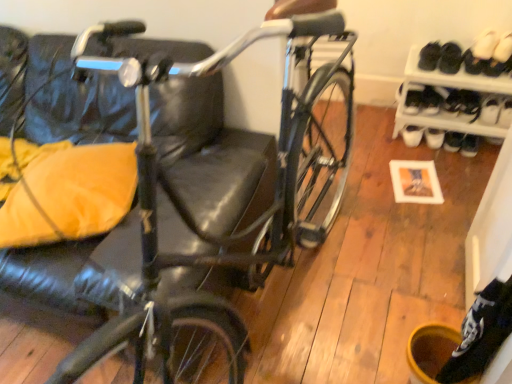
Find the location of `white suede shoe at upper right, the third footwear when ordered from left to right`. white suede shoe at upper right, the third footwear when ordered from left to right is located at coordinates (499, 56).

What is the approximate height of black suede shoes at upper right, which appears as the 1th footwear when viewed from the left?

black suede shoes at upper right, which appears as the 1th footwear when viewed from the left, is 4.62 inches tall.

Describe the element at coordinates (490, 110) in the screenshot. Image resolution: width=512 pixels, height=384 pixels. I see `white leather shoe at right` at that location.

What is the approximate height of shiny black bicycle at center?

shiny black bicycle at center is 1.20 meters in height.

Image resolution: width=512 pixels, height=384 pixels. Find the location of `orange fabric pillow at left`. orange fabric pillow at left is located at coordinates (71, 194).

I want to click on white plastic shoe rack at lower right, so click(x=450, y=100).

The height and width of the screenshot is (384, 512). I want to click on white suede shoe at upper right, the third footwear when ordered from left to right, so coord(499,56).

Can you tell me how much white leather shoe at right and white suede shoe at upper right, arranged as the 2th footwear when viewed from the right, differ in facing direction?

The angular difference between white leather shoe at right and white suede shoe at upper right, arranged as the 2th footwear when viewed from the right, is 4.27 degrees.

Is white leather shoe at right located outside white suede shoe at upper right, the 2th footwear from the left?

Absolutely, white leather shoe at right is external to white suede shoe at upper right, the 2th footwear from the left.

Can you confirm if white leather shoe at right is thinner than white suede shoe at upper right, arranged as the 2th footwear when viewed from the right?

Incorrect, the width of white leather shoe at right is not less than that of white suede shoe at upper right, arranged as the 2th footwear when viewed from the right.

From a real-world perspective, is white leather shoe at right above or below white suede shoe at upper right, arranged as the 2th footwear when viewed from the right?

From a real-world perspective, white leather shoe at right is physically below white suede shoe at upper right, arranged as the 2th footwear when viewed from the right.

From a real-world perspective, between black suede shoes at upper right, which appears as the 1th footwear when viewed from the left, and orange fabric pillow at left, who is vertically higher?

In real-world perspective, orange fabric pillow at left is above.

How far apart are black suede shoes at upper right, which appears as the 1th footwear when viewed from the left, and orange fabric pillow at left?

black suede shoes at upper right, which appears as the 1th footwear when viewed from the left, and orange fabric pillow at left are 5.75 feet apart.

Based on the photo, which object is thinner, black suede shoes at upper right, the 3th footwear viewed from the right, or orange fabric pillow at left?

black suede shoes at upper right, the 3th footwear viewed from the right.

Is black suede shoes at upper right, the 3th footwear viewed from the right, situated inside orange fabric pillow at left or outside?

black suede shoes at upper right, the 3th footwear viewed from the right, is located beyond the bounds of orange fabric pillow at left.

Locate an element on the screen. bicycle located in front of the white suede shoe at upper right, which is the first footwear in right-to-left order is located at coordinates (176, 185).

Considering the relative sizes of white suede shoe at upper right, which is the first footwear in right-to-left order, and shiny black bicycle at center in the image provided, is white suede shoe at upper right, which is the first footwear in right-to-left order, wider than shiny black bicycle at center?

Incorrect, the width of white suede shoe at upper right, which is the first footwear in right-to-left order, does not surpass that of shiny black bicycle at center.

From their relative heights in the image, would you say white suede shoe at upper right, the third footwear when ordered from left to right, is taller or shorter than shiny black bicycle at center?

white suede shoe at upper right, the third footwear when ordered from left to right, is shorter than shiny black bicycle at center.

From the image's perspective, is black suede shoes at upper right, the 3th footwear viewed from the right, located above or below white plastic shoe rack at lower right?

Clearly, from the image's perspective, black suede shoes at upper right, the 3th footwear viewed from the right, is above white plastic shoe rack at lower right.

Considering their positions, is black suede shoes at upper right, which appears as the 1th footwear when viewed from the left, located in front of or behind white plastic shoe rack at lower right?

Visually, black suede shoes at upper right, which appears as the 1th footwear when viewed from the left, is located behind white plastic shoe rack at lower right.

Is black suede shoes at upper right, which appears as the 1th footwear when viewed from the left, not within white plastic shoe rack at lower right?

black suede shoes at upper right, which appears as the 1th footwear when viewed from the left, lies outside white plastic shoe rack at lower right's area.

Could you measure the distance between black suede shoes at upper right, which appears as the 1th footwear when viewed from the left, and white plastic shoe rack at lower right?

black suede shoes at upper right, which appears as the 1th footwear when viewed from the left, is 7.32 inches away from white plastic shoe rack at lower right.

Consider the image. Between white plastic shoe rack at lower right and black suede shoes at upper right, which appears as the 1th footwear when viewed from the left, which one has smaller width?

black suede shoes at upper right, which appears as the 1th footwear when viewed from the left, is thinner.

Is white plastic shoe rack at lower right facing away from black suede shoes at upper right, which appears as the 1th footwear when viewed from the left?

No, white plastic shoe rack at lower right's orientation is not away from black suede shoes at upper right, which appears as the 1th footwear when viewed from the left.

Is white plastic shoe rack at lower right shorter than black suede shoes at upper right, which appears as the 1th footwear when viewed from the left?

Incorrect, the height of white plastic shoe rack at lower right does not fall short of that of black suede shoes at upper right, which appears as the 1th footwear when viewed from the left.

How many degrees apart are the facing directions of white plastic shoe rack at lower right and black suede shoes at upper right, which appears as the 1th footwear when viewed from the left?

0.0872 degrees.

From the image's perspective, is shiny black bicycle at center over white leather shoe at right?

No.

Does point (30, 61) lie in front of point (489, 118)?

Yes, point (30, 61) is closer to viewer.

Choose the correct answer: Is shiny black bicycle at center inside white leather shoe at right or outside it?

shiny black bicycle at center is spatially situated outside white leather shoe at right.

From the image's perspective, would you say white leather shoe at right is positioned over black suede shoes at upper right, which appears as the 1th footwear when viewed from the left?

Actually, white leather shoe at right appears below black suede shoes at upper right, which appears as the 1th footwear when viewed from the left, in the image.

Does white leather shoe at right have a lesser height compared to black suede shoes at upper right, which appears as the 1th footwear when viewed from the left?

Yes, white leather shoe at right is shorter than black suede shoes at upper right, which appears as the 1th footwear when viewed from the left.

Looking at this image, which point is more distant from viewer, (494, 110) or (442, 60)?

The point (442, 60) is farther from the camera.

Between white leather shoe at right and black suede shoes at upper right, which appears as the 1th footwear when viewed from the left, which one has smaller size?

white leather shoe at right.

From the image's perspective, starting from the white leather shoe at right, which footwear is the 3rd one above? Please provide its 2D coordinates.

[(480, 53)]

Locate an element on the screen. Image resolution: width=512 pixels, height=384 pixels. pillow in front of the black suede shoes at upper right, which appears as the 1th footwear when viewed from the left is located at coordinates (71, 194).

Based on their spatial positions, is shiny black bicycle at center or orange fabric pillow at left closer to white plastic shoe rack at lower right?

Based on the image, shiny black bicycle at center appears to be nearer to white plastic shoe rack at lower right.

Which object lies nearer to the anchor point black suede shoes at upper right, which appears as the 1th footwear when viewed from the left, white suede shoe at upper right, arranged as the 2th footwear when viewed from the right, or shiny black bicycle at center?

white suede shoe at upper right, arranged as the 2th footwear when viewed from the right, is positioned closer to the anchor black suede shoes at upper right, which appears as the 1th footwear when viewed from the left.

Based on their spatial positions, is black suede shoes at upper right, the 3th footwear viewed from the right, or white plastic shoe rack at lower right further from white suede shoe at upper right, the 2th footwear from the left?

white plastic shoe rack at lower right is positioned further to the anchor white suede shoe at upper right, the 2th footwear from the left.

From the picture: Which object lies further to the anchor point black suede shoes at upper right, the 3th footwear viewed from the right, white leather shoe at right or shiny black bicycle at center?

shiny black bicycle at center.

Estimate the real-world distances between objects in this image. Which object is closer to white plastic shoe rack at lower right, white suede shoe at upper right, the 2th footwear from the left, or black suede shoes at upper right, the 3th footwear viewed from the right?

black suede shoes at upper right, the 3th footwear viewed from the right, lies closer to white plastic shoe rack at lower right than the other object.

Based on the photo, considering their positions, is white suede shoe at upper right, which is the first footwear in right-to-left order, positioned closer to white suede shoe at upper right, the 2th footwear from the left, than shiny black bicycle at center?

white suede shoe at upper right, which is the first footwear in right-to-left order, is closer to white suede shoe at upper right, the 2th footwear from the left.

When comparing their distances from white suede shoe at upper right, the third footwear when ordered from left to right, does white suede shoe at upper right, arranged as the 2th footwear when viewed from the right, or shiny black bicycle at center seem further?

shiny black bicycle at center lies further to white suede shoe at upper right, the third footwear when ordered from left to right, than the other object.

From the image, which object appears to be nearer to black suede shoes at upper right, which appears as the 1th footwear when viewed from the left, white plastic shoe rack at lower right or white suede shoe at upper right, the third footwear when ordered from left to right?

Based on the image, white suede shoe at upper right, the third footwear when ordered from left to right, appears to be nearer to black suede shoes at upper right, which appears as the 1th footwear when viewed from the left.

Identify the location of footwear situated between black suede shoes at upper right, which appears as the 1th footwear when viewed from the left, and white suede shoe at upper right, the third footwear when ordered from left to right, from left to right. (480, 53).

Image resolution: width=512 pixels, height=384 pixels. Find the location of `shelf between white suede shoe at upper right, the third footwear when ordered from left to right, and white leather shoe at right, in the vertical direction`. shelf between white suede shoe at upper right, the third footwear when ordered from left to right, and white leather shoe at right, in the vertical direction is located at coordinates (450, 100).

Find the location of a particular element. The image size is (512, 384). shelf positioned between shiny black bicycle at center and black suede shoes at upper right, which appears as the 1th footwear when viewed from the left, from near to far is located at coordinates (450, 100).

The image size is (512, 384). Identify the location of footwear between shiny black bicycle at center and white plastic shoe rack at lower right along the z-axis. (480, 53).